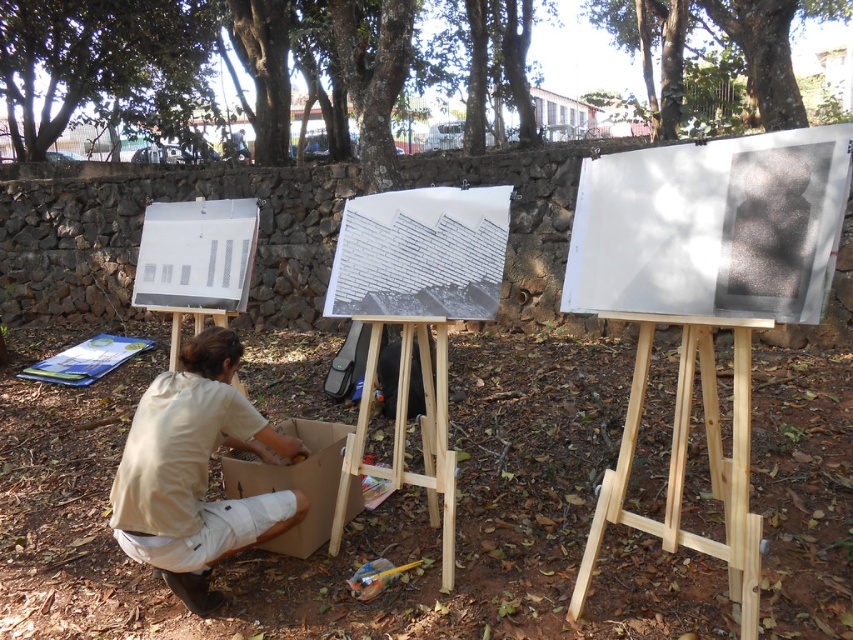
Question: Which point is farther to the camera?

Choices:
 (A) green leafy tree at upper left
 (B) wooden easel at center
 (C) green leafy tree at upper center
 (D) white paper at center

Answer: (C)

Question: Does green leafy tree at upper center have a smaller size compared to white paper at left?

Choices:
 (A) yes
 (B) no

Answer: (A)

Question: Which is nearer to the beige cotton shirt at lower left?

Choices:
 (A) wooden easel at center
 (B) brown textured tree at upper center

Answer: (A)

Question: Does white paper at left appear on the left side of cardboard box at lower center?

Choices:
 (A) no
 (B) yes

Answer: (B)

Question: Is wooden easel at center wider than cardboard box at lower center?

Choices:
 (A) yes
 (B) no

Answer: (A)

Question: Which of the following is the farthest from the observer?

Choices:
 (A) green leafy tree at upper center
 (B) white paper at center
 (C) white paper at left

Answer: (A)